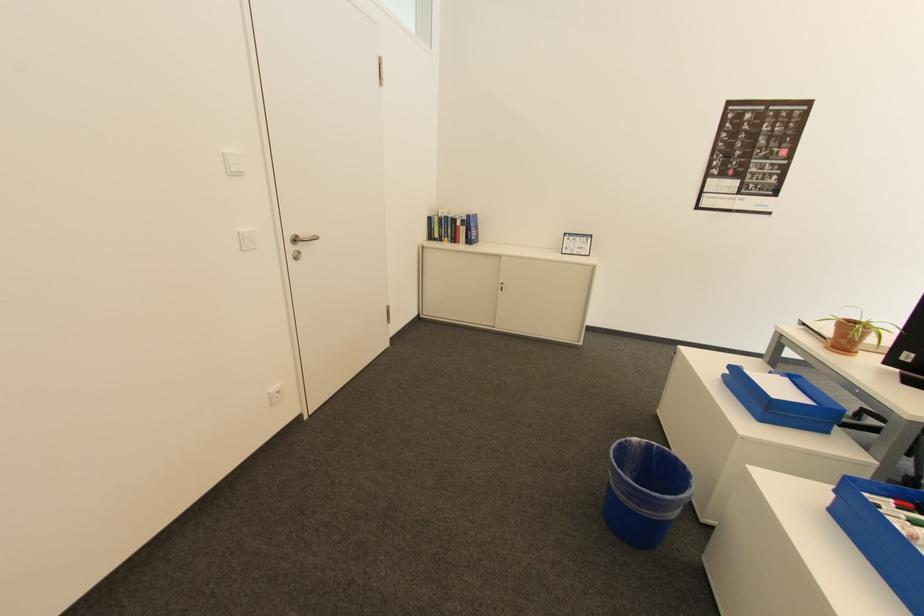
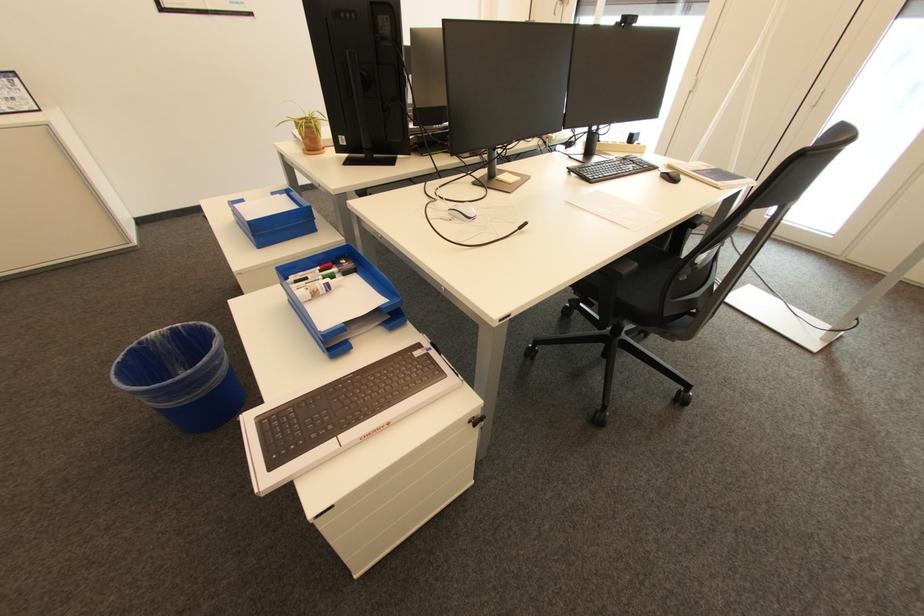
The first image is from the beginning of the video and the second image is from the end. How did the camera likely rotate when shooting the video?

The camera's rotation is toward right-down.